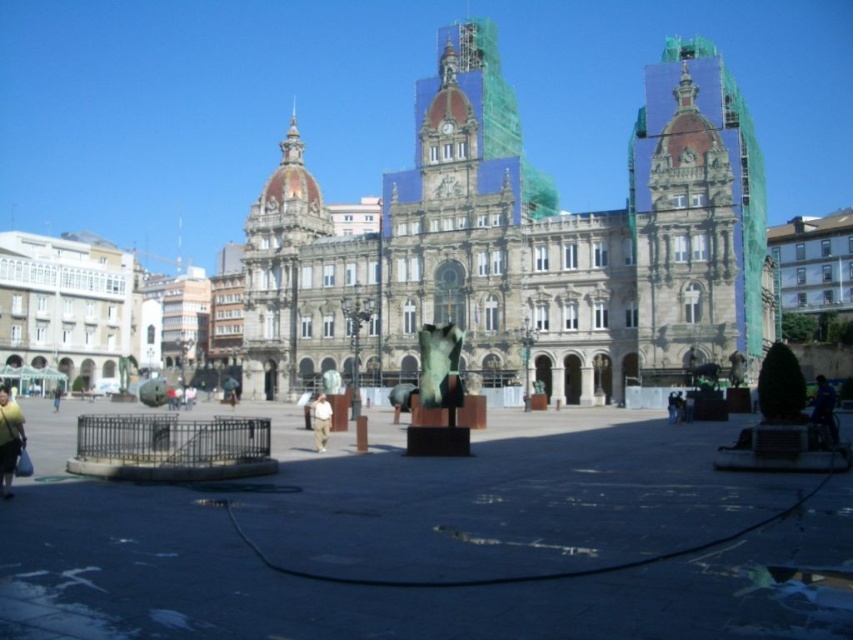
You are a tour guide leading a group to the entrance of the historic building. You see the bronze statue at center and the brushed metal cage at center in the plaza. Which object is closer to the building?

The bronze statue at center is closer to the building because it is in front of the brushed metal cage at center, which is further away.

You are standing in the plaza in front of the historic building and want to place your yellow fabric bag at lower left on the ground. Where exactly should you put it?

You should place the yellow fabric bag at lower left at the coordinates point (9, 440).